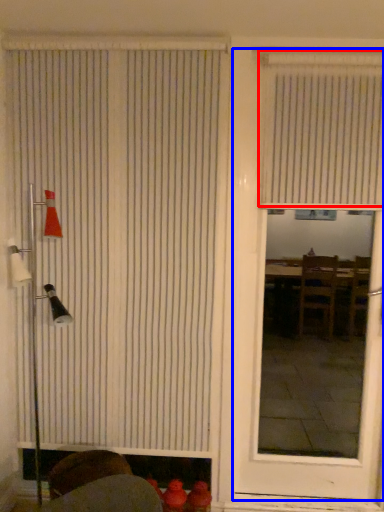
Question: Which object is closer to the camera taking this photo, window blind (highlighted by a red box) or door (highlighted by a blue box)?

Choices:
 (A) window blind
 (B) door

Answer: (B)